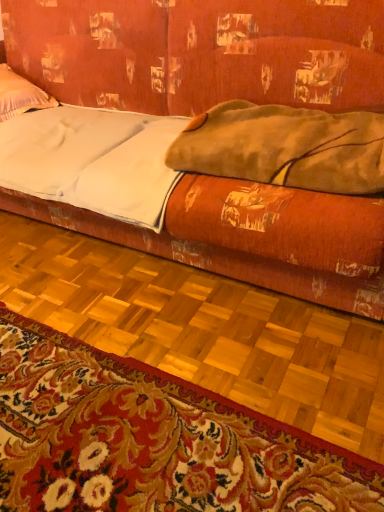
Question: Do you think carpeted mat at lower center is within velvet orange couch at center, or outside of it?

Choices:
 (A) inside
 (B) outside

Answer: (B)

Question: Is carpeted mat at lower center taller or shorter than velvet orange couch at center?

Choices:
 (A) short
 (B) tall

Answer: (A)

Question: Estimate the real-world distances between objects in this image. Which object is farther from the carpeted mat at lower center?

Choices:
 (A) white soft pillow at upper left
 (B) velvet orange couch at center
 (C) fuzzy brown blanket at upper right
 (D) white matte sheet at center

Answer: (A)

Question: Estimate the real-world distances between objects in this image. Which object is closer to the carpeted mat at lower center?

Choices:
 (A) velvet orange couch at center
 (B) white soft pillow at upper left
 (C) fuzzy brown blanket at upper right
 (D) white matte sheet at center

Answer: (D)